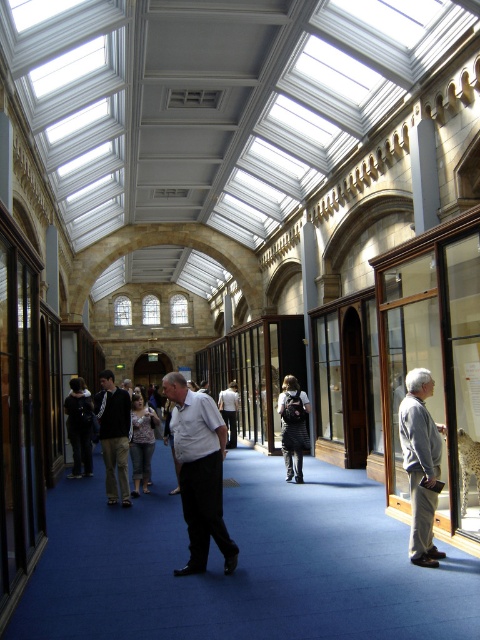
You are standing in the museum corridor and notice the dark gray fabric pants at center. Where exactly are they located in terms of coordinates?

The dark gray fabric pants at center are located at coordinates point (113, 435).

You are a visitor in the museum and want to place both the striped fabric backpack at center and the dark gray fabric jacket at center on a bench that can only hold items with a combined width of 1 meter. If the backpack is narrower than the jacket, what is the maximum possible width of the jacket?

The striped fabric backpack at center is narrower than the dark gray fabric jacket at center. Assuming the backpack takes up the minimum width, the maximum possible width of the jacket would be just under 1 meter, but since the backpack must also occupy some space, the exact maximum depends on the backpack width. However, since the backpack is narrower, the jacket could be up to nearly 1 meter wide if the backpack is very small.